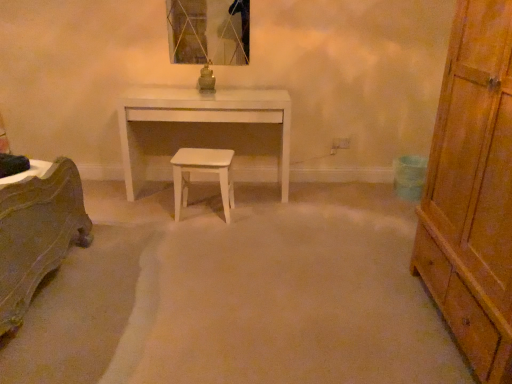
Question: Is metallic glass mirror at upper center not within white glossy desk at center?

Choices:
 (A) no
 (B) yes

Answer: (B)

Question: Considering the relative sizes of metallic glass mirror at upper center and white glossy desk at center in the image provided, is metallic glass mirror at upper center taller than white glossy desk at center?

Choices:
 (A) no
 (B) yes

Answer: (A)

Question: From the image's perspective, is metallic glass mirror at upper center below white glossy desk at center?

Choices:
 (A) no
 (B) yes

Answer: (A)

Question: From a real-world perspective, is metallic glass mirror at upper center positioned over white glossy desk at center based on gravity?

Choices:
 (A) no
 (B) yes

Answer: (B)

Question: Does metallic glass mirror at upper center turn towards white glossy desk at center?

Choices:
 (A) no
 (B) yes

Answer: (A)

Question: Considering the positions of metallic glass mirror at upper center and white matte stool at center in the image, is metallic glass mirror at upper center wider or thinner than white matte stool at center?

Choices:
 (A) thin
 (B) wide

Answer: (A)

Question: Considering their positions, is metallic glass mirror at upper center located in front of or behind white matte stool at center?

Choices:
 (A) behind
 (B) front

Answer: (A)

Question: In terms of size, does metallic glass mirror at upper center appear bigger or smaller than white matte stool at center?

Choices:
 (A) small
 (B) big

Answer: (A)

Question: Is metallic glass mirror at upper center to the left or to the right of white matte stool at center in the image?

Choices:
 (A) left
 (B) right

Answer: (A)

Question: Based on their positions, is white matte stool at center located to the left or right of metallic glass mirror at upper center?

Choices:
 (A) left
 (B) right

Answer: (B)

Question: From a real-world perspective, is white matte stool at center positioned above or below metallic glass mirror at upper center?

Choices:
 (A) above
 (B) below

Answer: (B)

Question: Considering the positions of point (228, 218) and point (190, 39), is point (228, 218) closer or farther from the camera than point (190, 39)?

Choices:
 (A) closer
 (B) farther

Answer: (A)

Question: In the image, is white matte stool at center positioned in front of or behind metallic glass mirror at upper center?

Choices:
 (A) behind
 (B) front

Answer: (B)

Question: In terms of size, does white matte stool at center appear bigger or smaller than white glossy desk at center?

Choices:
 (A) big
 (B) small

Answer: (B)

Question: Considering the positions of point (181, 198) and point (287, 190), is point (181, 198) closer or farther from the camera than point (287, 190)?

Choices:
 (A) farther
 (B) closer

Answer: (B)